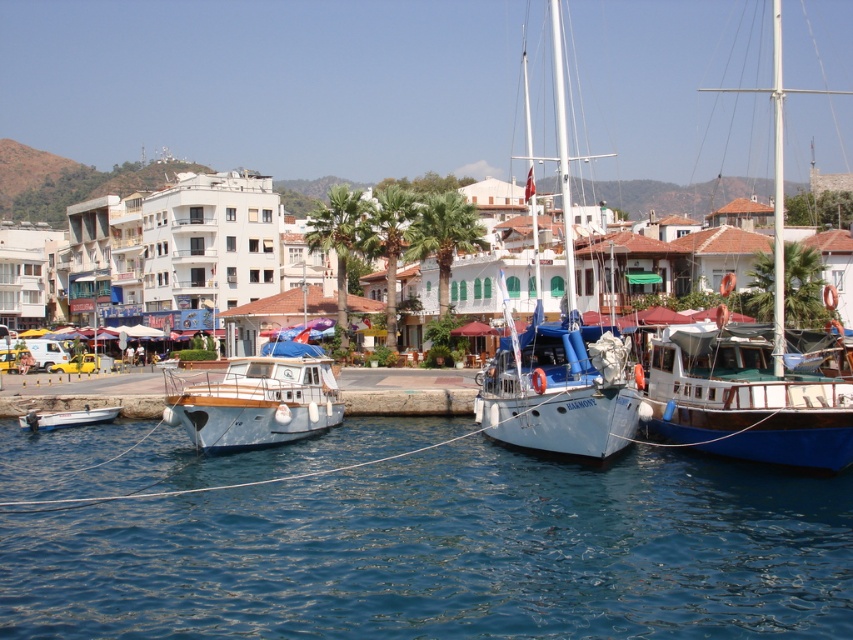
Does white wooden boat at right have a greater height compared to matte blue wooden boat at center?

Yes, white wooden boat at right is taller than matte blue wooden boat at center.

In the scene shown: Between white wooden boat at right and matte blue wooden boat at center, which one appears on the right side from the viewer's perspective?

Positioned to the right is white wooden boat at right.

You are a GUI agent. You are given a task and a screenshot of the screen. Output one action in this format:
    pyautogui.click(x=<x>, y=<y>)
    Task: Click on the white wooden boat at right
    This screenshot has width=853, height=640.
    Given the screenshot: What is the action you would take?
    pyautogui.click(x=752, y=394)

Identify the location of matte blue wooden boat at center. The image size is (853, 640). pyautogui.click(x=258, y=400).

Is point (229, 410) closer to camera compared to point (79, 412)?

Yes.

Between point (254, 376) and point (85, 406), which one is positioned in front?

Point (254, 376)

The height and width of the screenshot is (640, 853). I want to click on matte blue wooden boat at center, so click(x=258, y=400).

Is point (111, 557) positioned behind point (85, 410)?

No, it is not.

Who is taller, blue water at center or white matte boat at lower left?

With more height is blue water at center.

Does point (277, 467) come behind point (38, 422)?

No, (277, 467) is in front of (38, 422).

Identify the location of blue water at center. (450, 554).